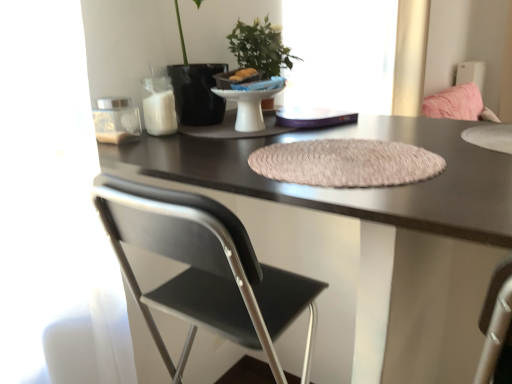
The width and height of the screenshot is (512, 384). What are the coordinates of `free space that is to the left of beige textured placemat at center` in the screenshot? It's located at (192, 158).